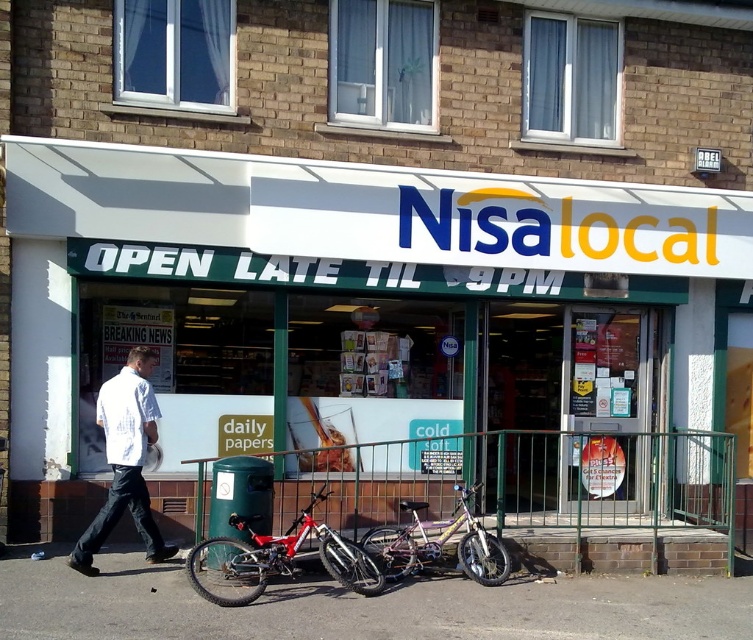
Consider the image. You are standing in front of the NisaLocal convenience store. There are two points marked on the store facade. The first point is at coordinate point [221,600] and the second is at point [428,541]. If you were to throw a small ball from your current position, which point would the ball reach first?

The ball would reach point [221,600] first because it is closer to the camera than point [428,541].

You are a customer standing in front of the NisaLocal store. You see a white plastic signboard at upper center and a metallic silver bicycle at center. Which object is positioned higher up?

The white plastic signboard at upper center is positioned higher up than the metallic silver bicycle at center.

You are standing in front of the NisaLocal convenience store and need to place a small trash can on the smooth asphalt pavement at lower center. What are the exact coordinates where you should place it?

The smooth asphalt pavement at lower center should be placed at coordinates point [361,605].